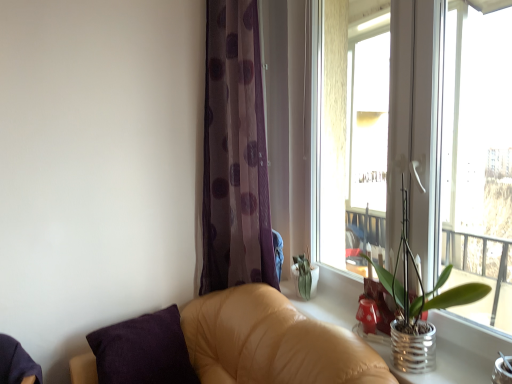
This screenshot has height=384, width=512. I want to click on vacant area situated below metallic silver pot at right (from a real-world perspective), so click(x=415, y=364).